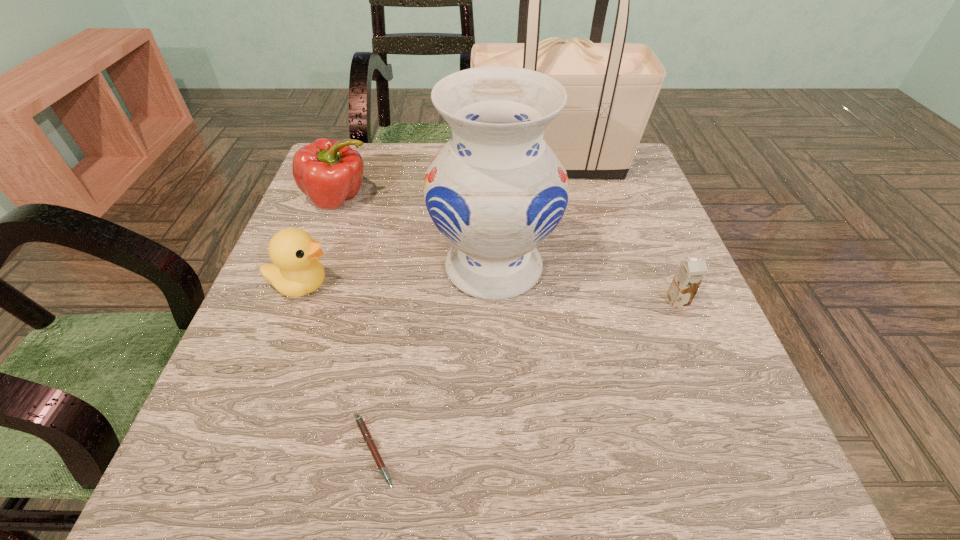
Where is `shopping bag that is positioned at the right edge`? shopping bag that is positioned at the right edge is located at coordinates (611, 88).

At what (x,y) coordinates should I click in order to perform the action: click on chocolate milk at the right edge. Please return your answer as a coordinate pair (x, y). This screenshot has width=960, height=540. Looking at the image, I should click on (691, 272).

Where is `object that is at the far left corner`? This screenshot has width=960, height=540. object that is at the far left corner is located at coordinates pyautogui.click(x=329, y=172).

Locate an element on the screen. object present at the far right corner is located at coordinates (611, 88).

Identify the location of free region at the far edge of the desktop. (427, 161).

Where is `blank space at the near edge`? blank space at the near edge is located at coordinates (491, 468).

The image size is (960, 540). In order to click on vacant region at the left edge of the desktop in this screenshot , I will do `click(306, 335)`.

Locate an element on the screen. The height and width of the screenshot is (540, 960). vacant area at the right edge is located at coordinates (674, 364).

The width and height of the screenshot is (960, 540). Find the location of `vacant area at the far left corner`. vacant area at the far left corner is located at coordinates (371, 150).

Locate an element on the screen. vacant space at the near right corner of the desktop is located at coordinates (774, 475).